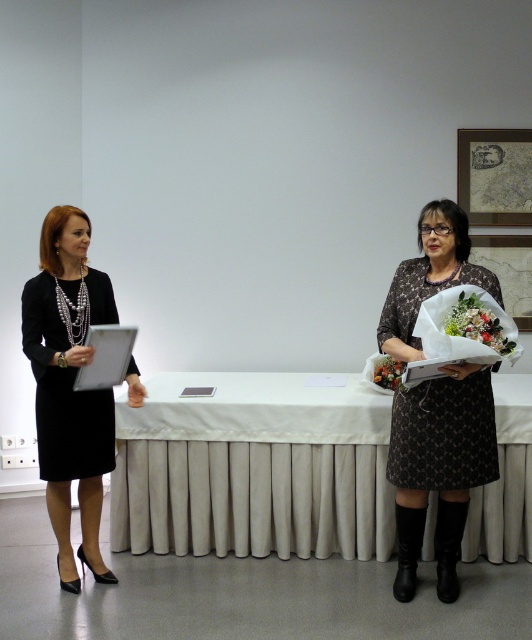
Does white cloth-covered table at center have a lesser height compared to fluffy floral bouquet at right?

No.

This screenshot has width=532, height=640. I want to click on white cloth-covered table at center, so click(x=253, y=468).

I want to click on white cloth-covered table at center, so click(x=253, y=468).

Identify the location of black leather boot at lower right. The width and height of the screenshot is (532, 640). (448, 547).

Is black leather boot at lower right wider than fluffy bouquet at right?

Yes, black leather boot at lower right is wider than fluffy bouquet at right.

Does point (444, 502) come behind point (381, 360)?

That is False.

Find the location of a particular element. The height and width of the screenshot is (640, 532). black leather boot at lower right is located at coordinates (448, 547).

Who is shorter, patterned fabric dress at right or fluffy bouquet at right?

fluffy bouquet at right

The image size is (532, 640). What do you see at coordinates (439, 467) in the screenshot?
I see `patterned fabric dress at right` at bounding box center [439, 467].

Who is more distant from viewer, (475, 413) or (385, 378)?

The point (385, 378) is more distant.

This screenshot has height=640, width=532. In order to click on patterned fabric dress at right in this screenshot , I will do `click(439, 467)`.